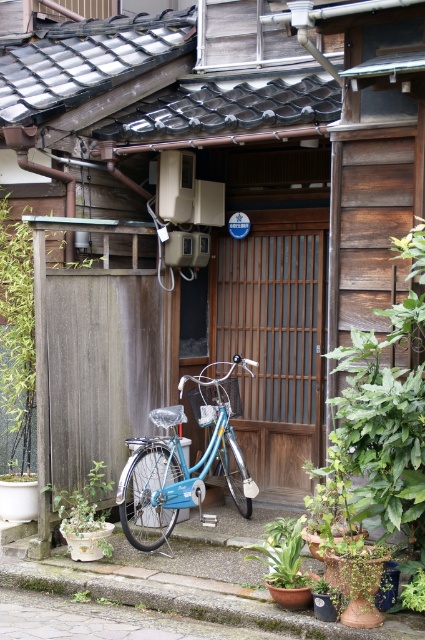
You are a visitor arriving at this Japanese house and want to park your bicycle. You see the green wood fence at left and the green matte pot at lower left. Which object is higher up relative to the other?

The green wood fence at left is located above the green matte pot at lower left, so the green wood fence at left is higher up.

You are a visitor to this Japanese residential area and want to know which object is larger between the green leafy plant at center and the green wood fence at left. Can you tell me?

The green leafy plant at center is bigger than the green wood fence at left.

You are standing in front of the wooden house with the slatted door and need to locate the green wood fence. According to the image, where is the point at coordinate (x=17, y=332) located?

The point at coordinate (x=17, y=332) is located on the green wood fence at left.